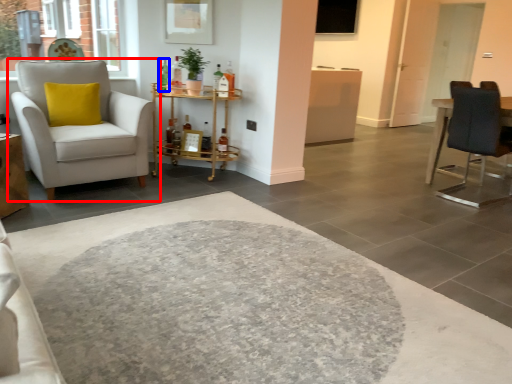
Question: Which of the following is the farthest to the observer, chair (highlighted by a red box) or bottle (highlighted by a blue box)?

Choices:
 (A) chair
 (B) bottle

Answer: (B)